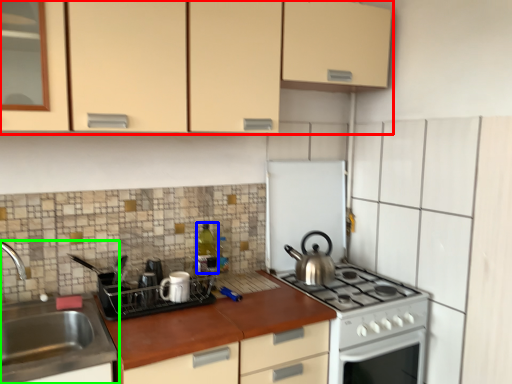
Question: Estimate the real-world distances between objects in this image. Which object is closer to cabinetry (highlighted by a red box), bottle (highlighted by a blue box) or sink (highlighted by a green box)?

Choices:
 (A) bottle
 (B) sink

Answer: (A)